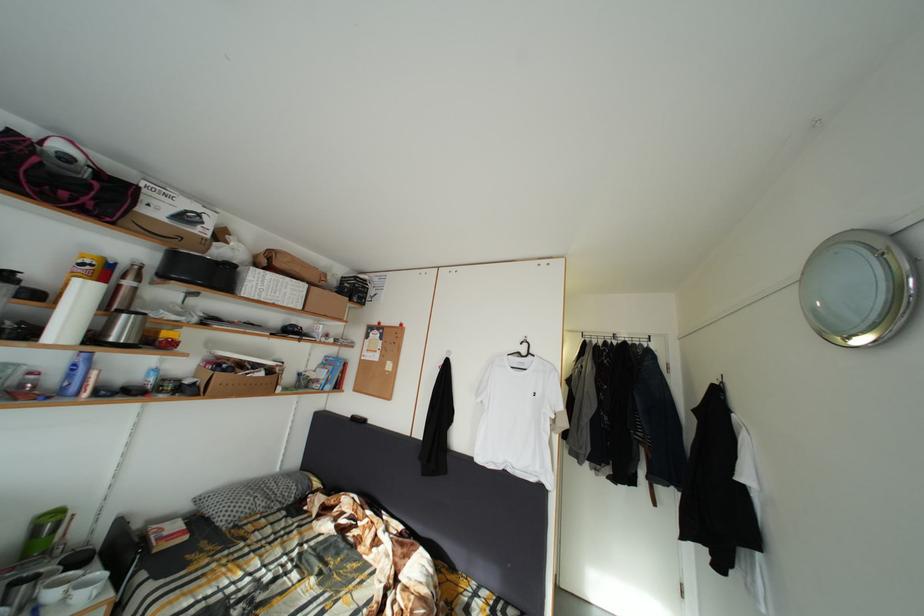
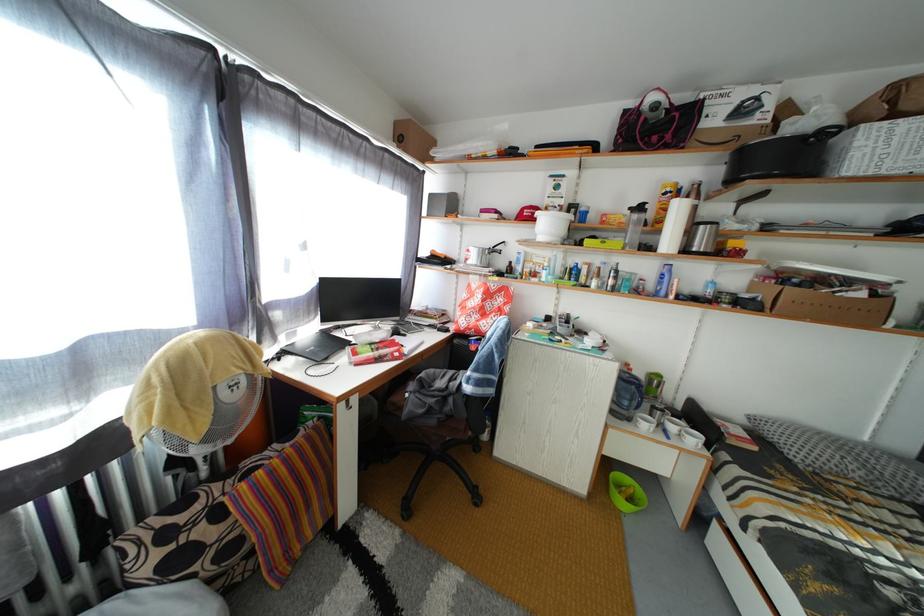
Question: The first image is from the beginning of the video and the second image is from the end. How did the camera likely rotate when shooting the video?

Choices:
 (A) Left
 (B) Right
 (C) Up
 (D) Down

Answer: (A)